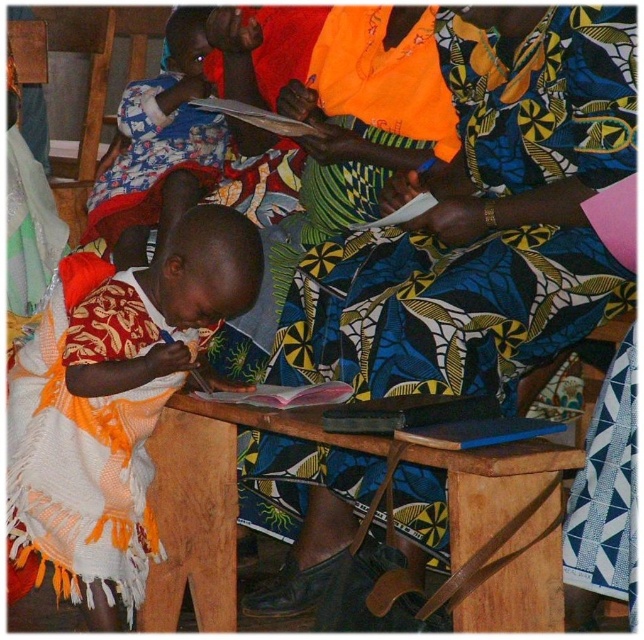
Between printed fabric skirt at center and wooden table at center, which one appears on the left side from the viewer's perspective?

wooden table at center

At what (x,y) coordinates should I click in order to perform the action: click on printed fabric skirt at center. Please return your answer as a coordinate pair (x, y). Looking at the image, I should click on (484, 220).

Does matte orange cloth at center have a larger size compared to wooden table at center?

No, matte orange cloth at center is not bigger than wooden table at center.

Does matte orange cloth at center come in front of wooden table at center?

No, matte orange cloth at center is behind wooden table at center.

What do you see at coordinates (115, 408) in the screenshot?
I see `matte orange cloth at center` at bounding box center [115, 408].

The width and height of the screenshot is (644, 640). Find the location of `matte orange cloth at center`. matte orange cloth at center is located at coordinates (115, 408).

Which is in front, point (545, 355) or point (167, 156)?

Point (545, 355) is in front.

Locate an element on the screen. printed fabric skirt at center is located at coordinates (484, 220).

Locate an element on the screen. This screenshot has width=644, height=640. printed fabric skirt at center is located at coordinates (484, 220).